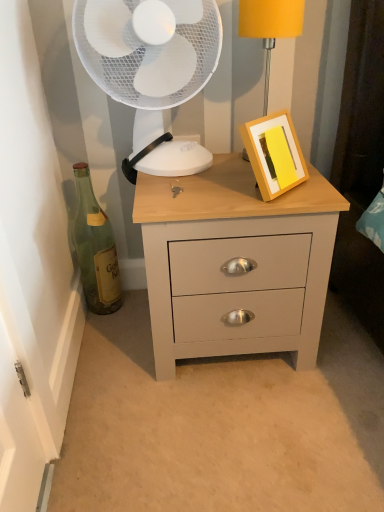
Question: Does yellow matte picture frame at upper right have a larger size compared to matte gray chest of drawers at center?

Choices:
 (A) yes
 (B) no

Answer: (B)

Question: From a real-world perspective, is yellow matte picture frame at upper right positioned over matte gray chest of drawers at center based on gravity?

Choices:
 (A) yes
 (B) no

Answer: (A)

Question: Is yellow matte picture frame at upper right to the left of matte gray chest of drawers at center from the viewer's perspective?

Choices:
 (A) yes
 (B) no

Answer: (B)

Question: Considering the relative sizes of yellow matte picture frame at upper right and matte gray chest of drawers at center in the image provided, is yellow matte picture frame at upper right wider than matte gray chest of drawers at center?

Choices:
 (A) yes
 (B) no

Answer: (B)

Question: Can you confirm if yellow matte picture frame at upper right is smaller than matte gray chest of drawers at center?

Choices:
 (A) yes
 (B) no

Answer: (A)

Question: Considering the relative sizes of yellow matte picture frame at upper right and matte gray chest of drawers at center in the image provided, is yellow matte picture frame at upper right shorter than matte gray chest of drawers at center?

Choices:
 (A) no
 (B) yes

Answer: (B)

Question: Is matte yellow lampshade at upper right located outside yellow matte picture frame at upper right?

Choices:
 (A) yes
 (B) no

Answer: (A)

Question: Is matte yellow lampshade at upper right taller than yellow matte picture frame at upper right?

Choices:
 (A) yes
 (B) no

Answer: (A)

Question: Can you confirm if matte yellow lampshade at upper right is wider than yellow matte picture frame at upper right?

Choices:
 (A) no
 (B) yes

Answer: (B)

Question: Is the position of matte yellow lampshade at upper right less distant than that of yellow matte picture frame at upper right?

Choices:
 (A) yes
 (B) no

Answer: (B)

Question: Does matte yellow lampshade at upper right appear on the left side of yellow matte picture frame at upper right?

Choices:
 (A) yes
 (B) no

Answer: (B)

Question: From a real-world perspective, is matte yellow lampshade at upper right over yellow matte picture frame at upper right?

Choices:
 (A) no
 (B) yes

Answer: (B)

Question: From the image's perspective, is white plastic fan at upper center on matte yellow lampshade at upper right?

Choices:
 (A) yes
 (B) no

Answer: (B)